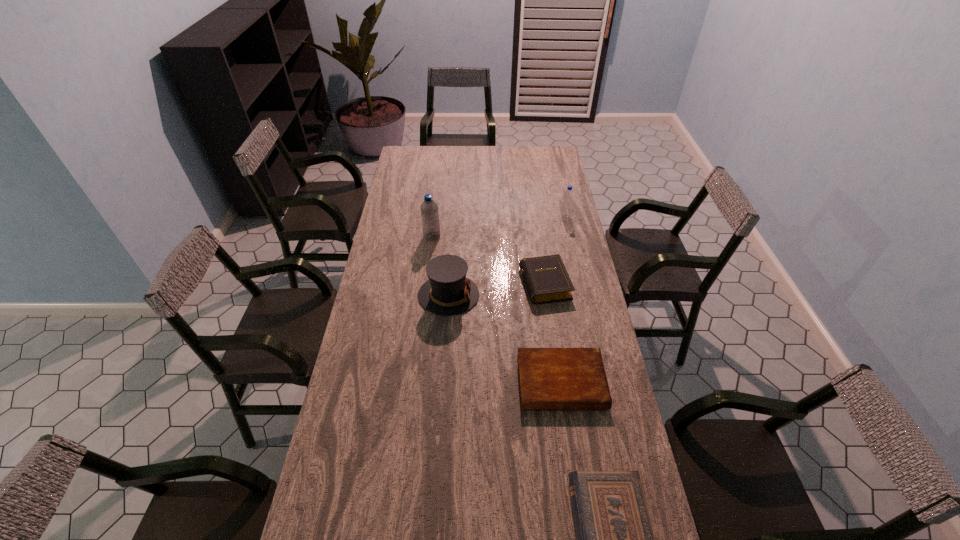
Locate which object is the fifth closest to the farthest Bible. Please provide its 2D coordinates. Your answer should be formatted as a tuple, i.e. [(x, y)], where the tuple contains the x and y coordinates of a point satisfying the conditions above.

[(615, 539)]

You are a GUI agent. You are given a task and a screenshot of the screen. Output one action in this format:
    pyautogui.click(x=<x>, y=<y>)
    Task: Click on the object that is the fourth closest one to the second nearest Bible
    Image resolution: width=960 pixels, height=540 pixels.
    Given the screenshot: What is the action you would take?
    [429, 209]

Locate an element on the screen. This screenshot has width=960, height=540. Bible that is the third closest one to the dress hat is located at coordinates (615, 539).

Where is `Bible that stands as the closest to the left water bottle`? This screenshot has height=540, width=960. Bible that stands as the closest to the left water bottle is located at coordinates (546, 278).